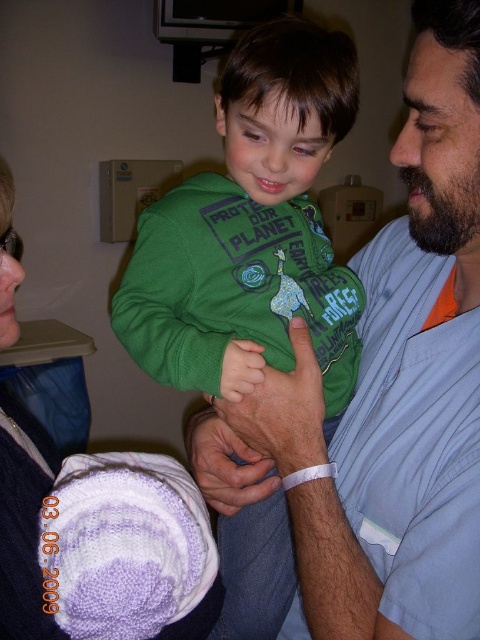
Question: Can you confirm if blue cotton shirt at center is thinner than green cotton hoodie at center?

Choices:
 (A) yes
 (B) no

Answer: (A)

Question: Which object is closer to the camera taking this photo?

Choices:
 (A) blue cotton shirt at center
 (B) green cotton hoodie at center
 (C) knitted purple sweater at lower left

Answer: (A)

Question: Considering the real-world distances, which object is closest to the green cotton hoodie at center?

Choices:
 (A) blue cotton shirt at center
 (B) knitted purple sweater at lower left

Answer: (A)

Question: Can you confirm if blue cotton shirt at center is smaller than green cotton hoodie at center?

Choices:
 (A) yes
 (B) no

Answer: (B)

Question: Can you confirm if blue cotton shirt at center is thinner than knitted purple sweater at lower left?

Choices:
 (A) yes
 (B) no

Answer: (A)

Question: Which point appears farthest from the camera in this image?

Choices:
 (A) (16, 452)
 (B) (321, 612)
 (C) (265, 342)

Answer: (C)